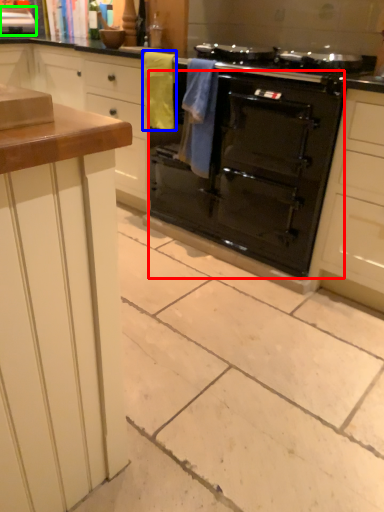
Question: Estimate the real-world distances between objects in this image. Which object is farther from oven (highlighted by a red box), material (highlighted by a blue box) or appliance (highlighted by a green box)?

Choices:
 (A) material
 (B) appliance

Answer: (B)